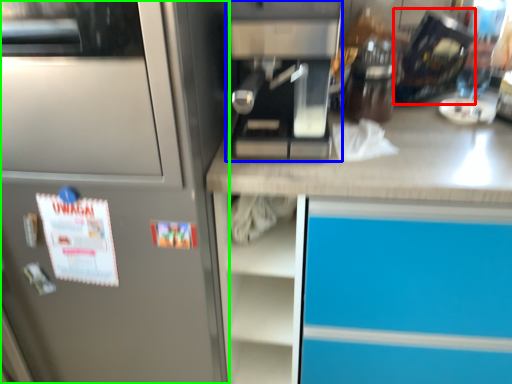
Question: Based on their relative distances, which object is farther from appliance (highlighted by a red box)? Choose from kitchen appliance (highlighted by a blue box) and home appliance (highlighted by a green box).

Choices:
 (A) kitchen appliance
 (B) home appliance

Answer: (B)